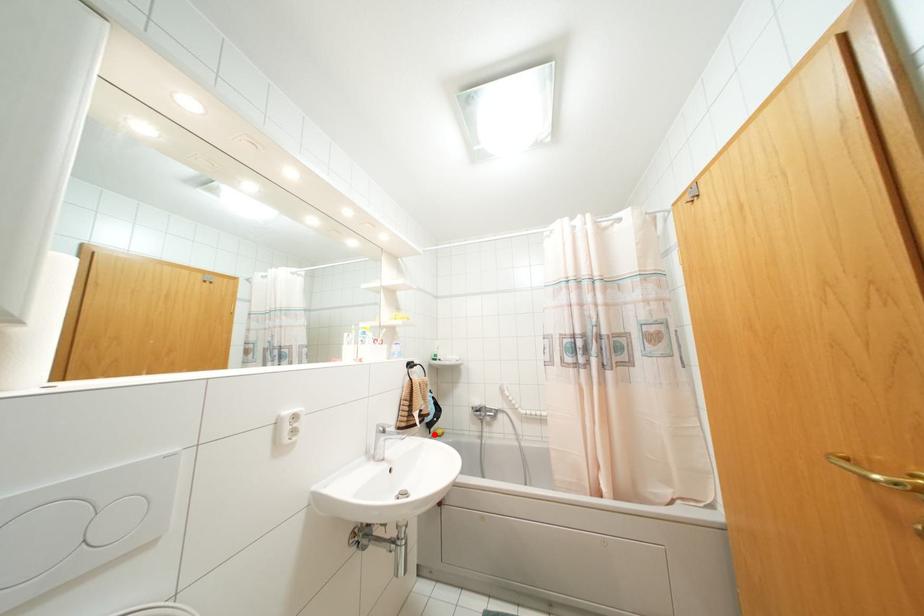
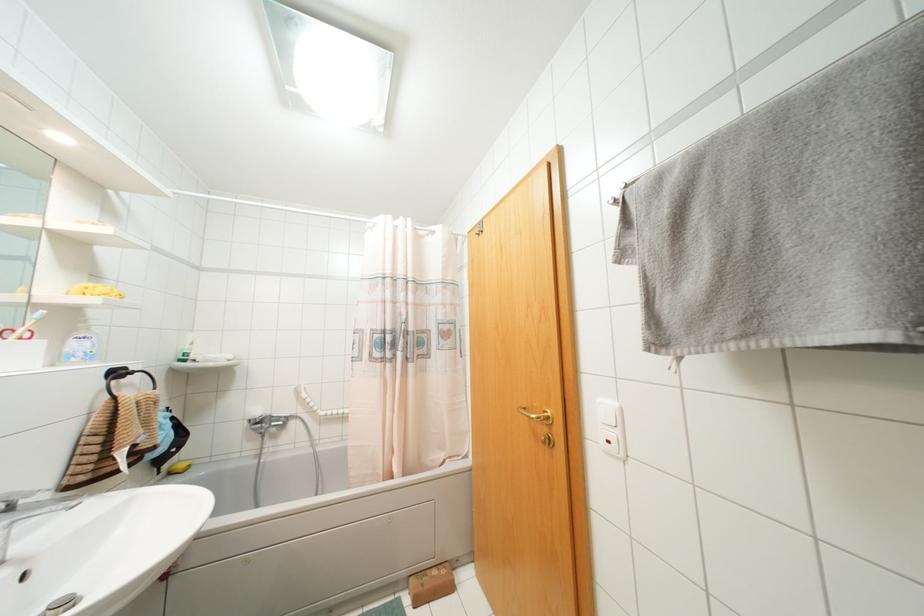
Where in the second image is the point corresponding to the highlighted location from the first image?

(169, 472)